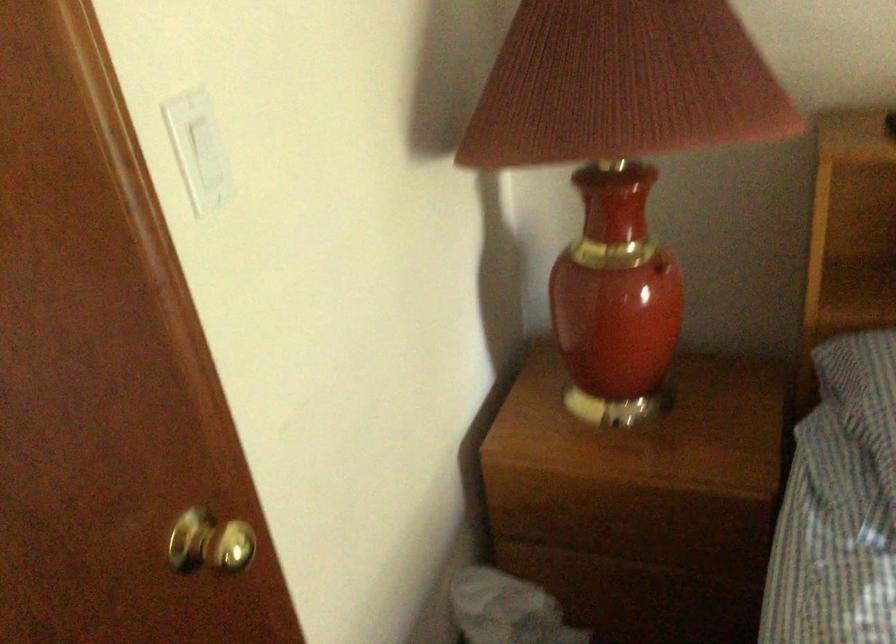
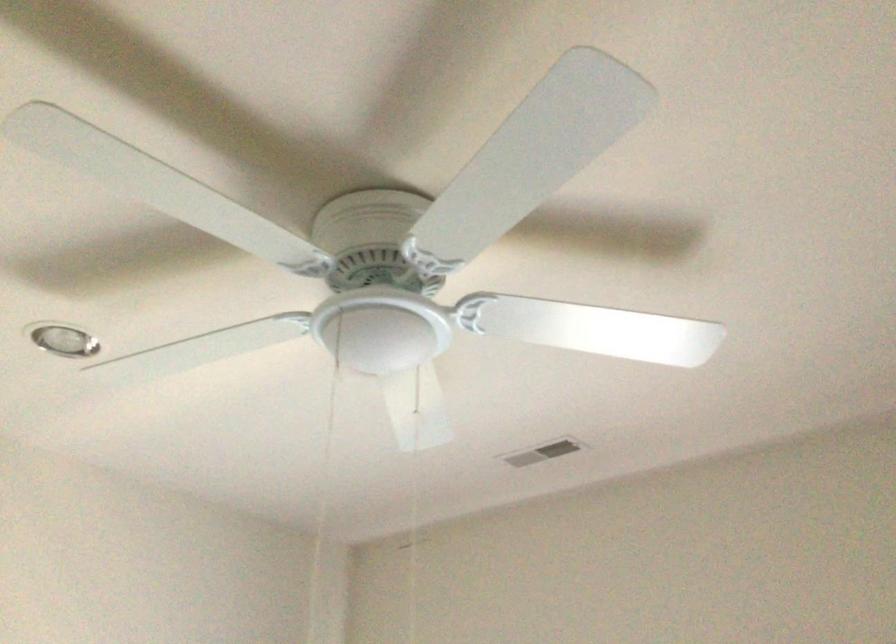
The first image is from the beginning of the video and the second image is from the end. How did the camera likely rotate when shooting the video?

The rotation direction of the camera is right-up.